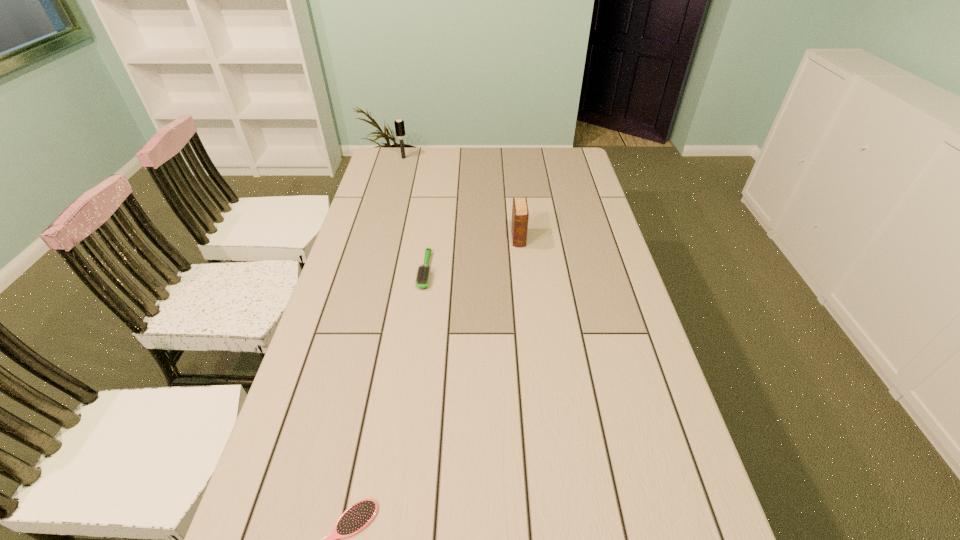
Choose which object is the second nearest neighbor to the rightmost object. Please provide its 2D coordinates. Your answer should be formatted as a tuple, i.e. [(x, y)], where the tuple contains the x and y coordinates of a point satisfying the conditions above.

[(399, 124)]

Identify which object is located as the third nearest to the tallest hairbrush. Please provide its 2D coordinates. Your answer should be formatted as a tuple, i.e. [(x, y)], where the tuple contains the x and y coordinates of a point satisfying the conditions above.

[(358, 516)]

Point out which hairbrush is positioned as the nearest to the rightmost object. Please provide its 2D coordinates. Your answer should be formatted as a tuple, i.e. [(x, y)], where the tuple contains the x and y coordinates of a point satisfying the conditions above.

[(422, 277)]

Identify which hairbrush is the closest to the diary. Please provide its 2D coordinates. Your answer should be formatted as a tuple, i.e. [(x, y)], where the tuple contains the x and y coordinates of a point satisfying the conditions above.

[(422, 277)]